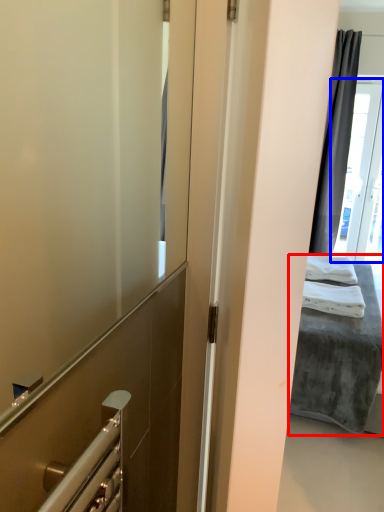
Question: Which point is closer to the camera, bed (highlighted by a red box) or glass door (highlighted by a blue box)?

Choices:
 (A) bed
 (B) glass door

Answer: (A)